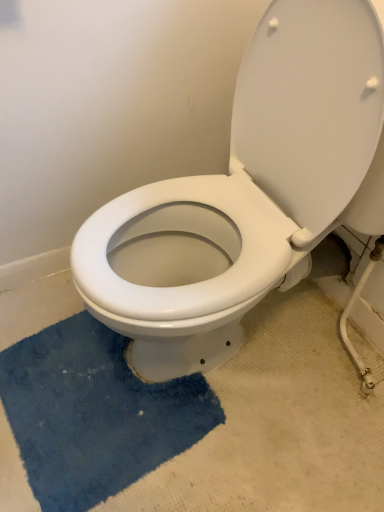
Locate an element on the screen. unoccupied area in front of white glossy toilet at center is located at coordinates (226, 462).